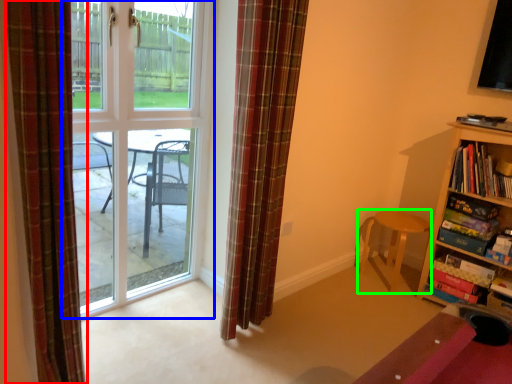
Question: Which object is the closest to the curtain (highlighted by a red box)? Choose among these: door (highlighted by a blue box) or chair (highlighted by a green box).

Choices:
 (A) door
 (B) chair

Answer: (A)